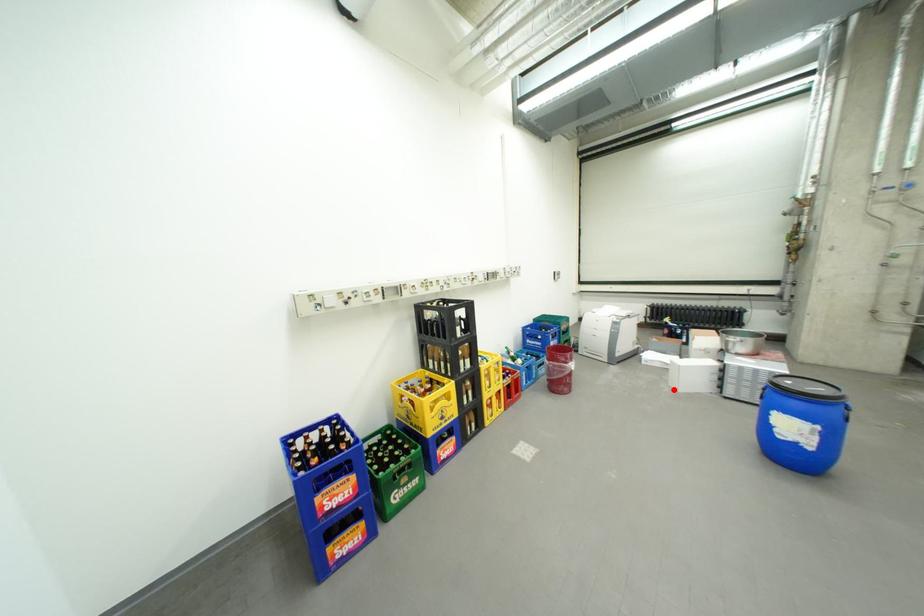
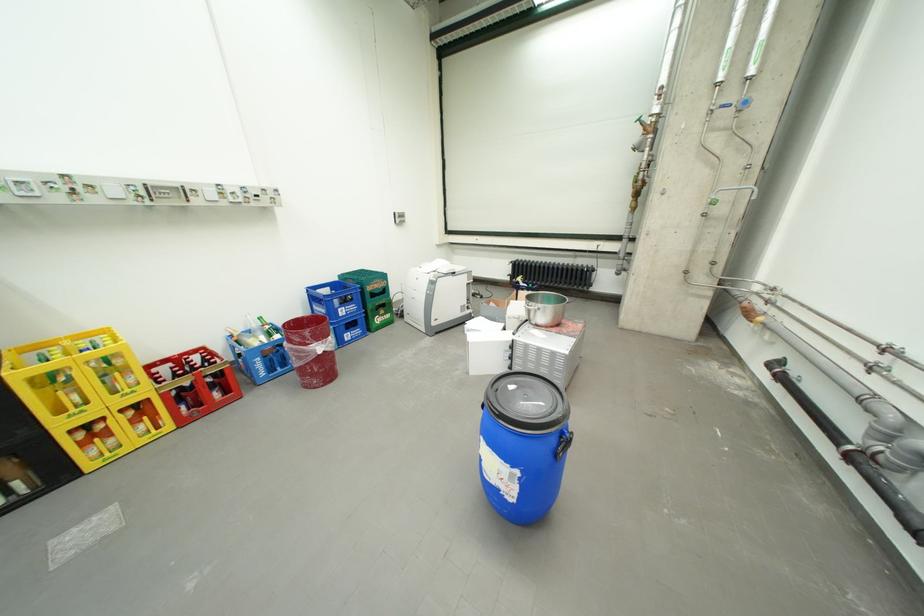
Question: I am providing you with two images of the same scene from different viewpoints. A red point is shown in image1. For the corresponding object point in image2, is it positioned nearer or farther from the camera?

Choices:
 (A) Nearer
 (B) Farther

Answer: (B)